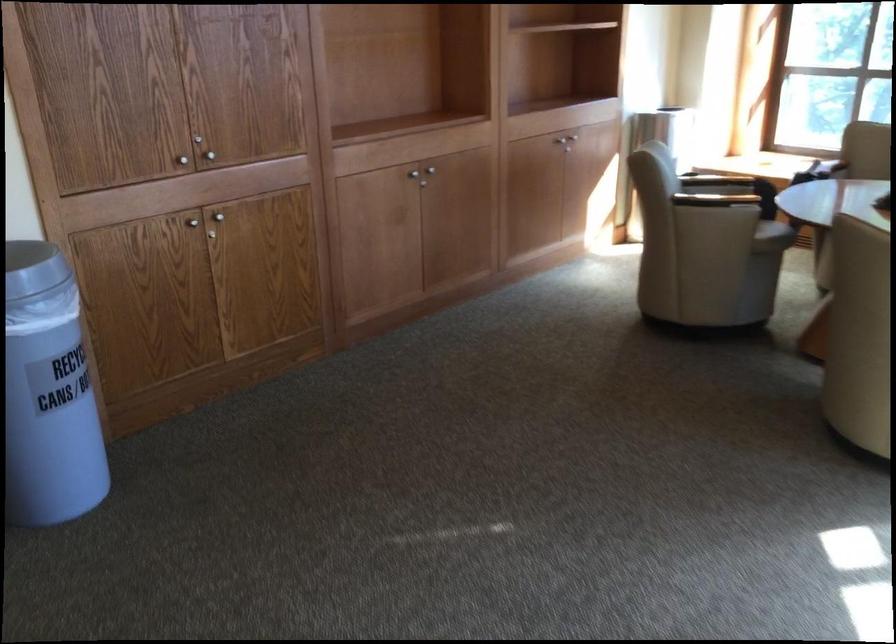
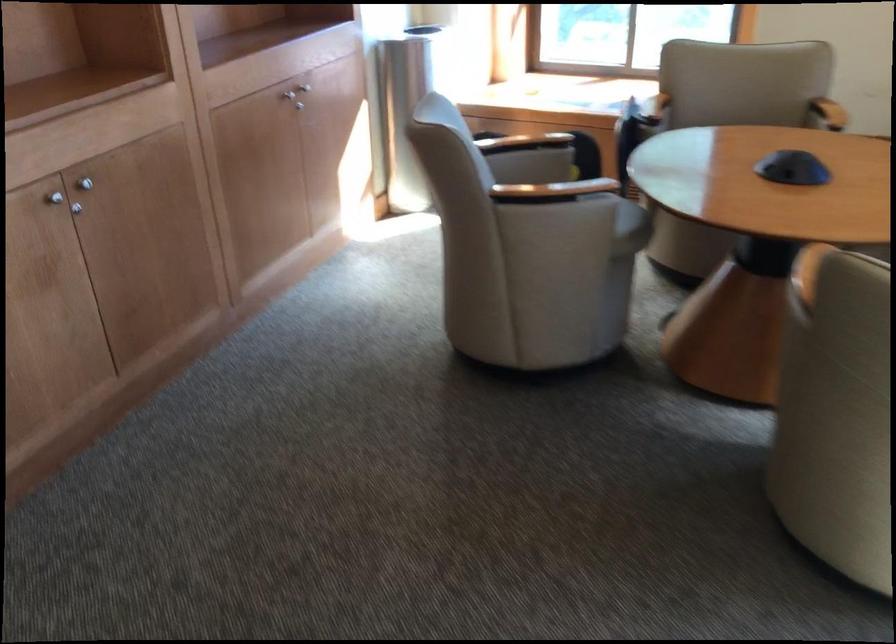
Question: What movement of the cameraman would produce the second image?

Choices:
 (A) Left
 (B) Right
 (C) Forward
 (D) Backward

Answer: (C)